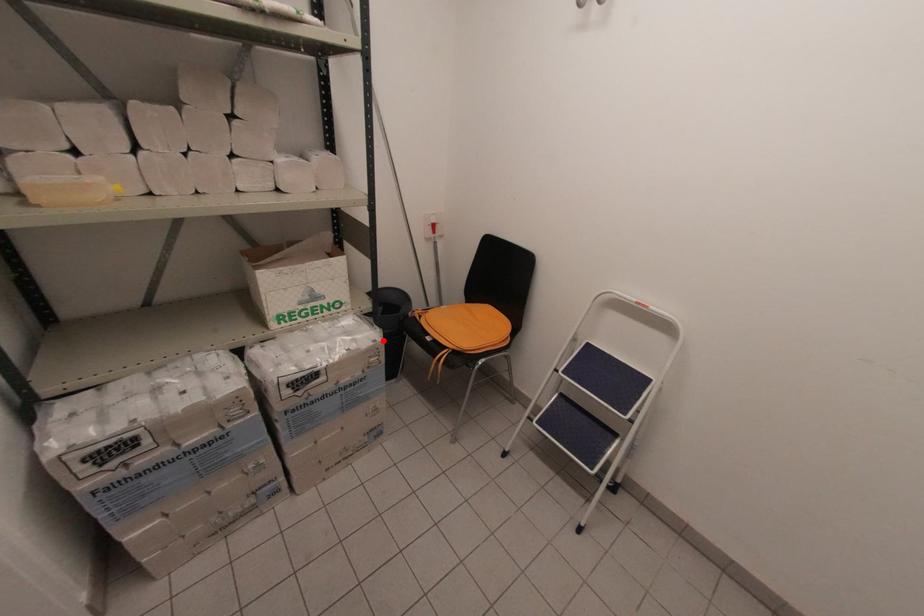
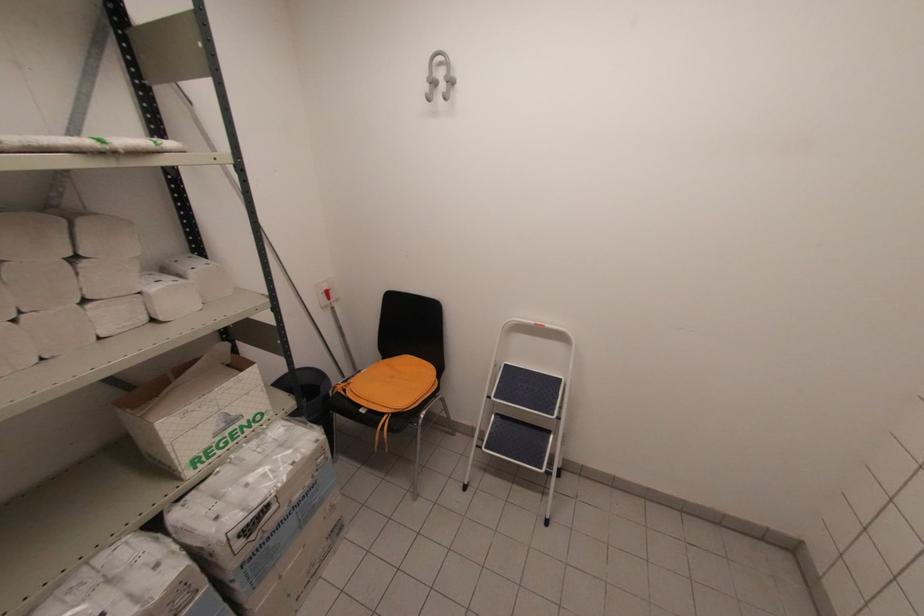
Question: I am providing you with two images of the same scene from different viewpoints. A red point is shown in image1. For the corresponding object point in image2, is it positioned nearer or farther from the camera?

Choices:
 (A) Nearer
 (B) Farther

Answer: (A)